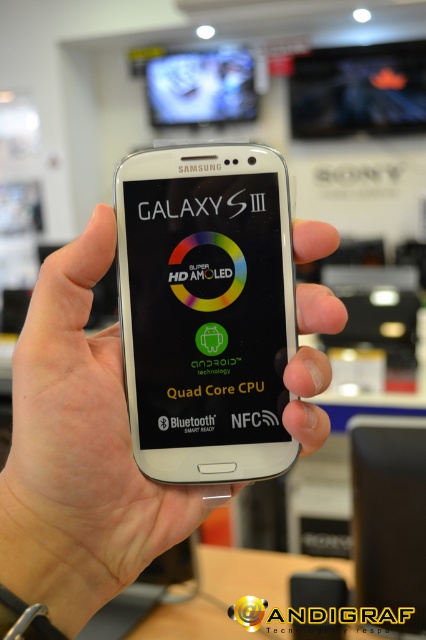
You are a customer in an electronics store looking at the white matte phone at center and the matte black screen at upper center. Which object is taller?

The matte black screen at upper center is taller than the white matte phone at center.

You are a customer in an electronics store looking at the white glossy phone at center and the matte black screen at upper center. Which object is positioned lower in the scene?

The white glossy phone at center is positioned lower than the matte black screen at upper center.